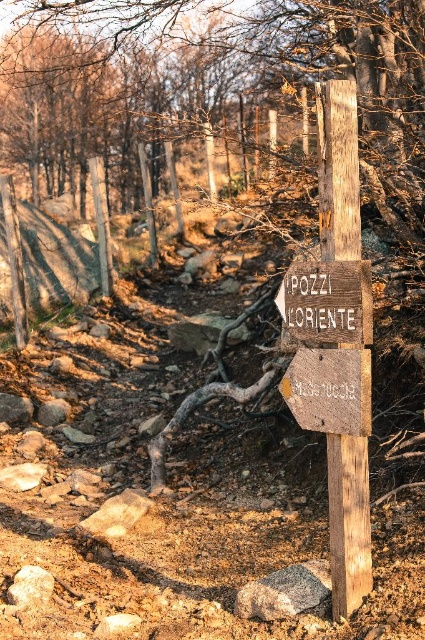
You are a hiker who has just arrived at the wooden sign at center and the weathered wood sign at center. You need to place a 10 inch ruler horizontally between them. Will the ruler fit without overlapping either sign?

The distance between wooden sign at center and weathered wood sign at center is 8.92 inches. Since the ruler is 10 inches long, it will not fit as it is longer than the space available.